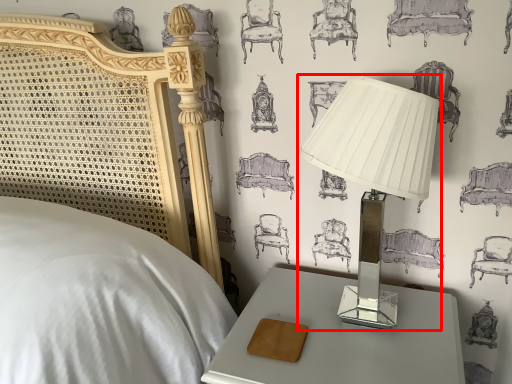
Question: From the image's perspective, what is the correct spatial positioning of lamp (annotated by the red box) in reference to nightstand?

Choices:
 (A) below
 (B) above

Answer: (B)